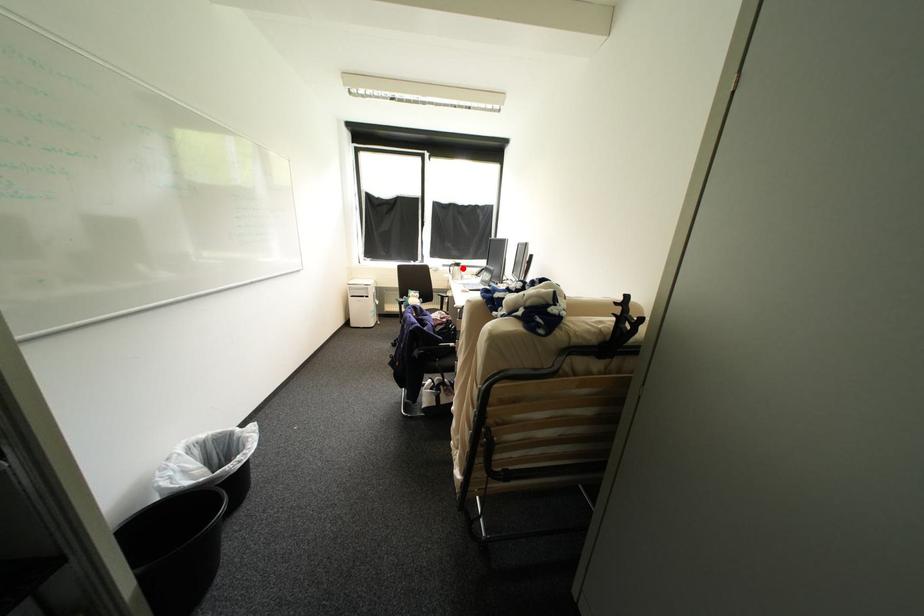
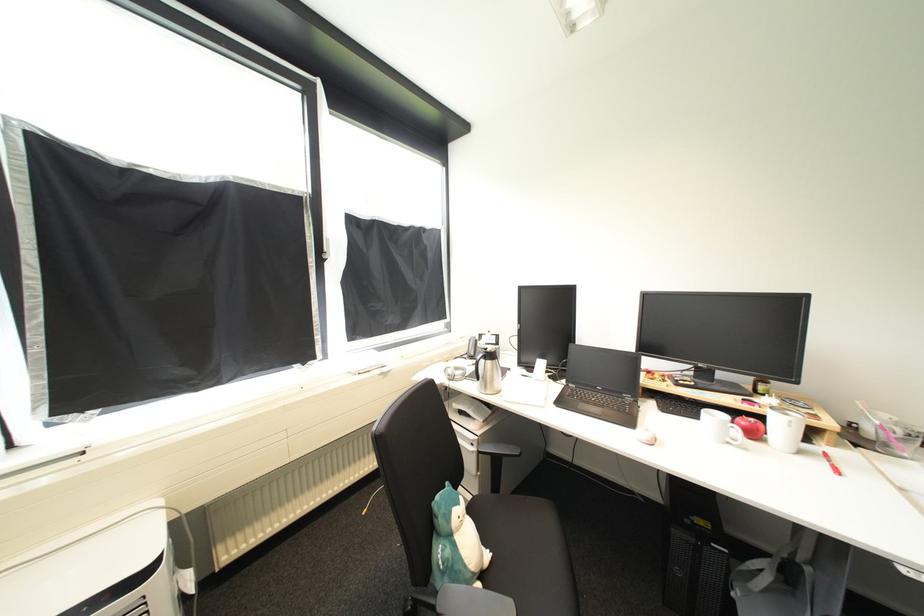
The point at the highlighted location is marked in the first image. Where is the corresponding point in the second image?

(495, 363)